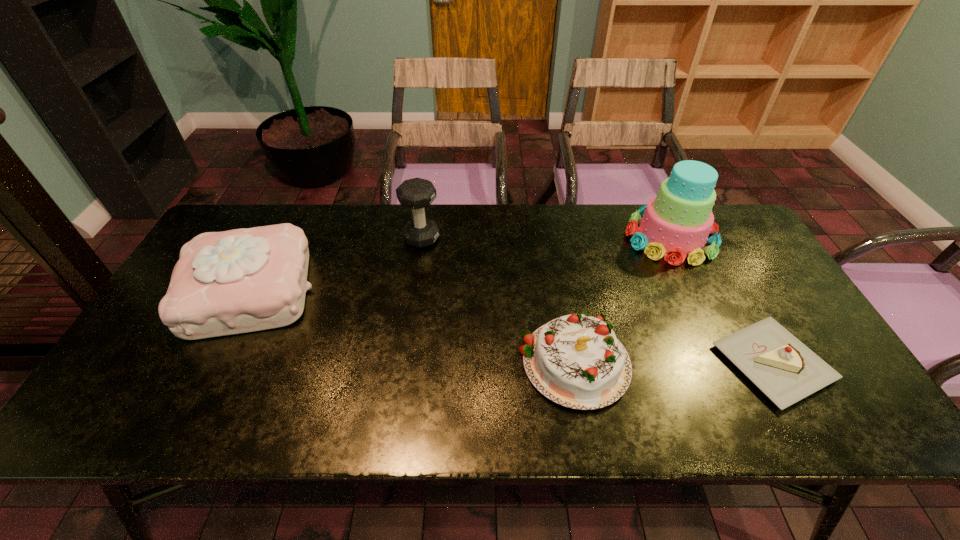
What are the coordinates of `the tallest cake` in the screenshot? It's located at (676, 223).

Locate an element on the screen. This screenshot has width=960, height=540. the second object from left to right is located at coordinates (417, 193).

Locate an element on the screen. dumbbell is located at coordinates (417, 193).

You are a GUI agent. You are given a task and a screenshot of the screen. Output one action in this format:
    pyautogui.click(x=<x>, y=<y>)
    Task: Click on the leftmost object
    
    Given the screenshot: What is the action you would take?
    pyautogui.click(x=243, y=280)

Identify the location of the third cake from right to left. (576, 361).

You are a GUI agent. You are given a task and a screenshot of the screen. Output one action in this format:
    pyautogui.click(x=<x>, y=<y>)
    Task: Click on the shortest cake
    The width and height of the screenshot is (960, 540).
    Given the screenshot: What is the action you would take?
    pyautogui.click(x=781, y=366)

This screenshot has width=960, height=540. I want to click on vacant space situated 0.170m on the front of the tallest cake, so click(x=706, y=310).

This screenshot has width=960, height=540. I want to click on vacant region located on the right of the dumbbell, so click(497, 238).

I want to click on vacant space located 0.170m on the right of the leftmost cake, so click(377, 291).

The image size is (960, 540). What are the coordinates of `vacant area located on the back of the third object from left to right` in the screenshot? It's located at (554, 252).